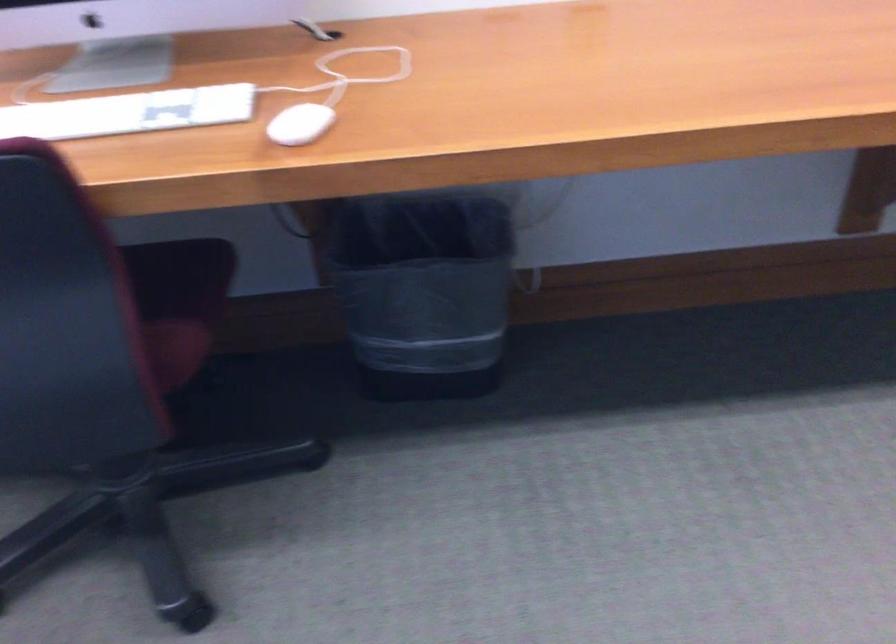
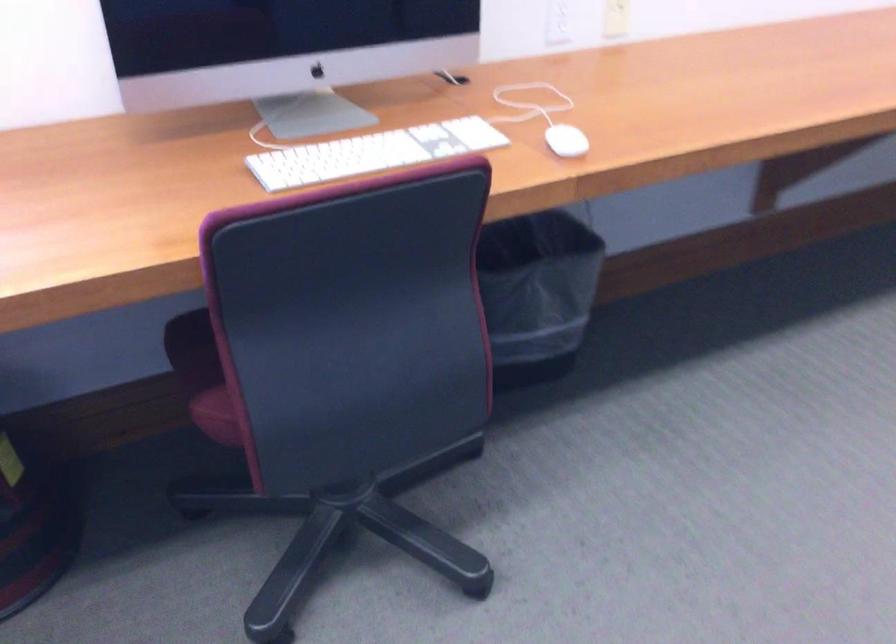
Where in the second image is the point corresponding to [288,126] from the first image?

(565, 140)